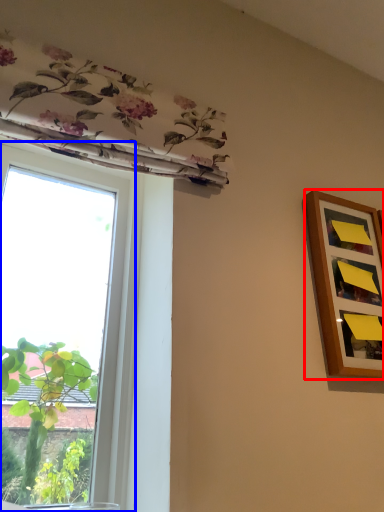
Question: Which of the following is the closest to the observer, picture frame (highlighted by a red box) or window (highlighted by a blue box)?

Choices:
 (A) picture frame
 (B) window

Answer: (B)